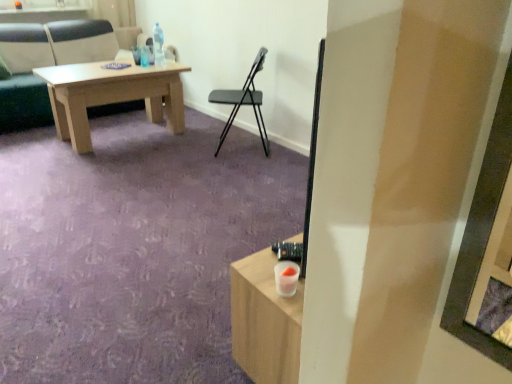
Where is `free spot to the right of black plastic chair at center, the second chair in the back-to-front sequence`? This screenshot has height=384, width=512. free spot to the right of black plastic chair at center, the second chair in the back-to-front sequence is located at coordinates (282, 152).